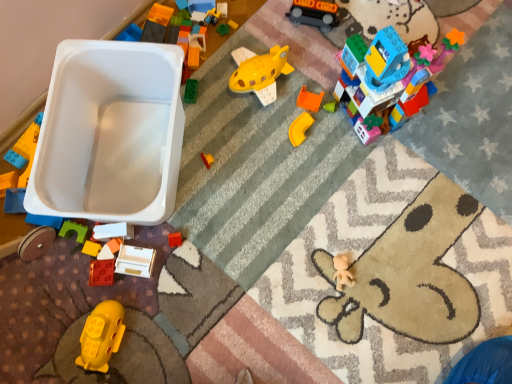
Identify the location of blank area to the left of white matte block at lower left, arranged as the fifth toy when ordered from the bottom. This screenshot has height=384, width=512. (55, 266).